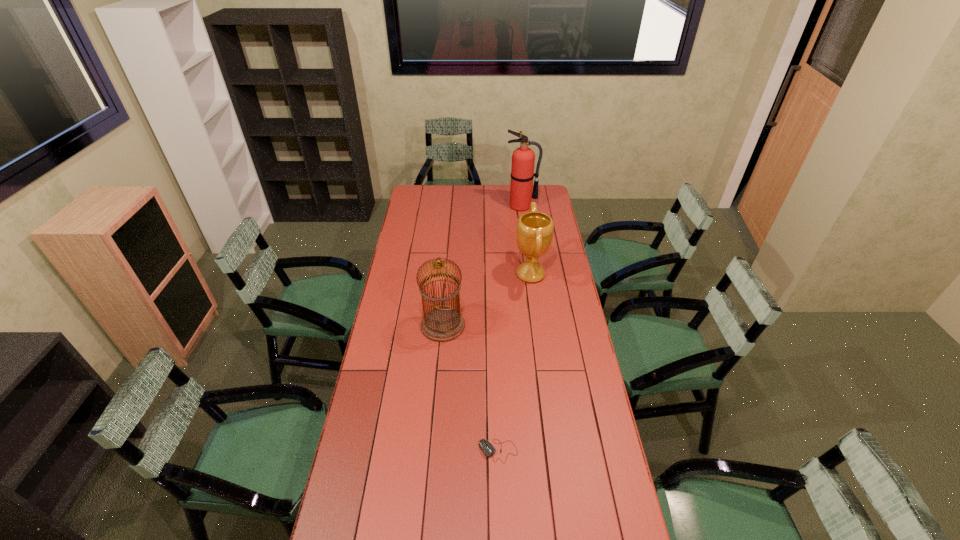
This screenshot has height=540, width=960. In order to click on the farthest object in this screenshot , I will do `click(523, 158)`.

Locate an element on the screen. the tallest object is located at coordinates (523, 158).

At what (x,y) coordinates should I click in order to perform the action: click on birdcage. Please return your answer as a coordinate pair (x, y). Looking at the image, I should click on (442, 324).

Locate an element on the screen. The image size is (960, 540). the third farthest object is located at coordinates (442, 324).

Image resolution: width=960 pixels, height=540 pixels. I want to click on the second farthest object, so click(x=534, y=230).

Find the location of a particular element. This screenshot has height=540, width=960. the nearest object is located at coordinates (488, 449).

Locate an element on the screen. The height and width of the screenshot is (540, 960). the third object from right to left is located at coordinates (488, 449).

Find the location of a particular element. The width and height of the screenshot is (960, 540). vacant space located at the nozzle of the tallest object is located at coordinates (527, 248).

Image resolution: width=960 pixels, height=540 pixels. What are the coordinates of `free space located on the front-facing side of the birdcage` in the screenshot? It's located at (497, 326).

Identify the location of vacant space located on the front of the award with the decoration. (501, 274).